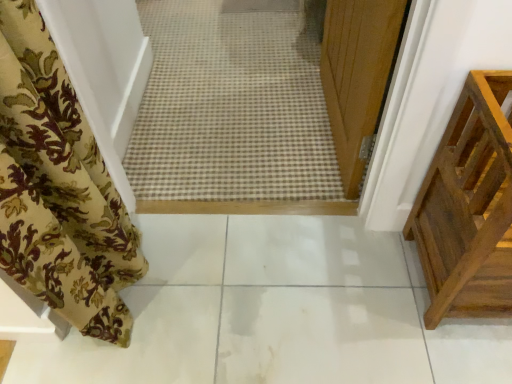
Question: From the image's perspective, is white glossy tile at center located above floral fabric curtain at left?

Choices:
 (A) no
 (B) yes

Answer: (A)

Question: Is floral fabric curtain at left completely or partially inside white glossy tile at center?

Choices:
 (A) no
 (B) yes

Answer: (A)

Question: From the image's perspective, is white glossy tile at center located beneath floral fabric curtain at left?

Choices:
 (A) no
 (B) yes

Answer: (B)

Question: Is white glossy tile at center taller than floral fabric curtain at left?

Choices:
 (A) yes
 (B) no

Answer: (B)

Question: Are white glossy tile at center and floral fabric curtain at left beside each other?

Choices:
 (A) yes
 (B) no

Answer: (B)

Question: Does white glossy tile at center come behind floral fabric curtain at left?

Choices:
 (A) yes
 (B) no

Answer: (A)

Question: Considering the relative sizes of white glossy tile at center and brown wooden crate at right in the image provided, is white glossy tile at center shorter than brown wooden crate at right?

Choices:
 (A) no
 (B) yes

Answer: (B)

Question: Is white glossy tile at center aimed at brown wooden crate at right?

Choices:
 (A) no
 (B) yes

Answer: (A)

Question: Can you confirm if white glossy tile at center is bigger than brown wooden crate at right?

Choices:
 (A) no
 (B) yes

Answer: (A)

Question: Is brown wooden crate at right at the back of white glossy tile at center?

Choices:
 (A) no
 (B) yes

Answer: (A)

Question: From a real-world perspective, is white glossy tile at center located higher than brown wooden crate at right?

Choices:
 (A) no
 (B) yes

Answer: (A)

Question: Is white glossy tile at center surrounding brown wooden crate at right?

Choices:
 (A) no
 (B) yes

Answer: (A)

Question: Is floral fabric curtain at left not near white glossy tile at center?

Choices:
 (A) yes
 (B) no

Answer: (B)